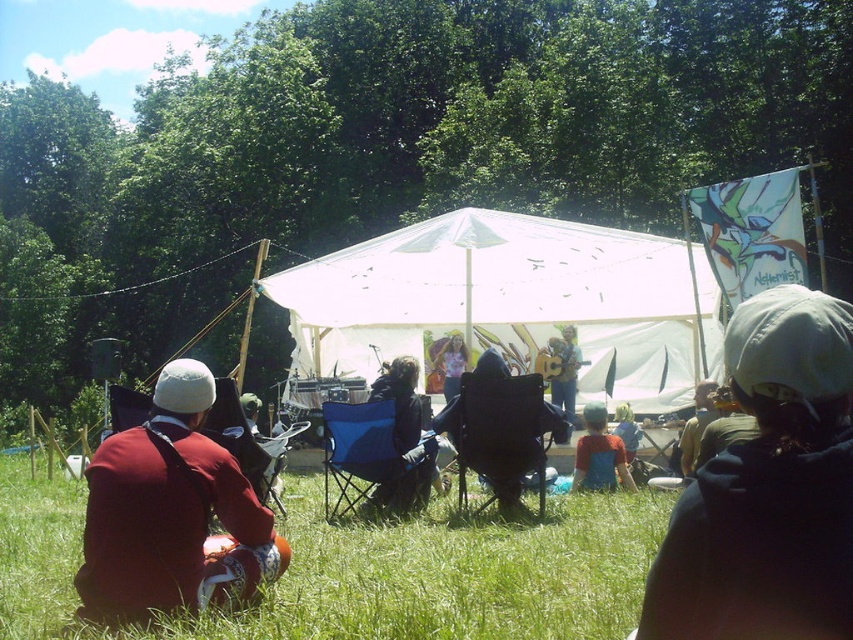
Who is more forward, (x=815, y=509) or (x=378, y=452)?

Point (x=815, y=509)

Does dark gray hooded sweatshirt at center have a lesser height compared to blue fabric chair at center?

Yes.

Does point (735, 621) lie behind point (399, 456)?

No, it is not.

The image size is (853, 640). In order to click on dark gray hooded sweatshirt at center in this screenshot , I will do `click(769, 488)`.

Is white canvas tent at center below matte pink shirt at center?

No.

Is white canvas tent at center further to the viewer compared to matte pink shirt at center?

No, it is in front of matte pink shirt at center.

Who is more forward, (706, 323) or (457, 392)?

Point (706, 323) is more forward.

Locate an element on the screen. This screenshot has height=640, width=853. white canvas tent at center is located at coordinates (502, 301).

Does matte pink shirt at center have a smaller size compared to blue denim shirt at center?

No, matte pink shirt at center is not smaller than blue denim shirt at center.

This screenshot has width=853, height=640. Find the location of `matte pink shirt at center`. matte pink shirt at center is located at coordinates (451, 364).